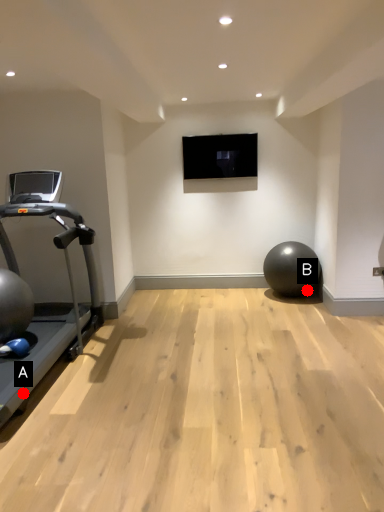
Question: Two points are circled on the image, labeled by A and B beside each circle. Among these points, which one is farthest from the camera?

Choices:
 (A) A is further
 (B) B is further

Answer: (B)